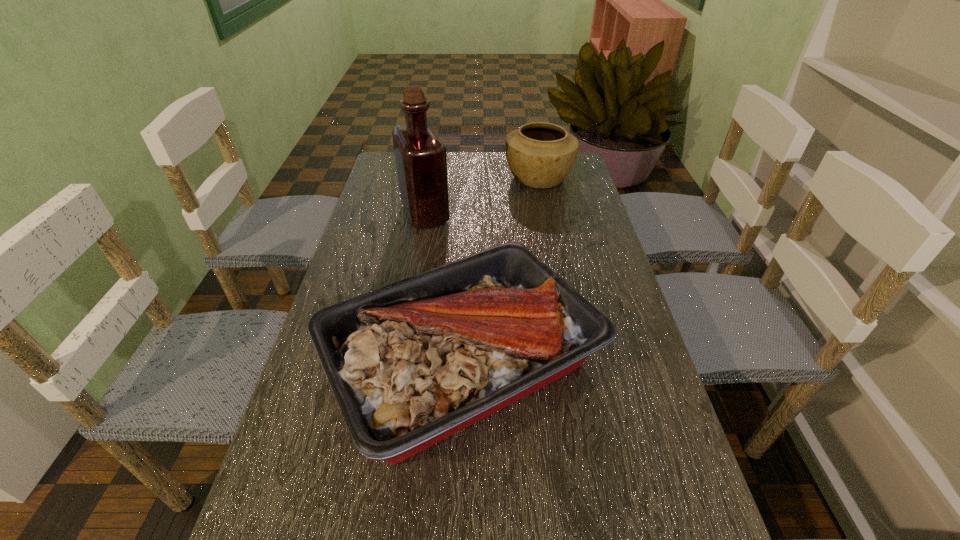
Find the location of a particular element. The width and height of the screenshot is (960, 540). tray that is at the left edge is located at coordinates (411, 363).

Identify the location of pottery located in the right edge section of the desktop. The height and width of the screenshot is (540, 960). (540, 155).

This screenshot has width=960, height=540. I want to click on tray that is at the right edge, so click(411, 363).

The width and height of the screenshot is (960, 540). I want to click on object present at the far right corner, so click(540, 155).

This screenshot has width=960, height=540. Identify the location of vacant space at the far edge. (452, 181).

Locate an element on the screen. The image size is (960, 540). vacant space at the left edge of the desktop is located at coordinates (372, 218).

In order to click on free space at the right edge in this screenshot , I will do `click(587, 222)`.

Where is `free point between the farthest object and the liquor`? The width and height of the screenshot is (960, 540). free point between the farthest object and the liquor is located at coordinates coord(482,195).

Select which object appears as the second closest to the tallest object. Please provide its 2D coordinates. Your answer should be formatted as a tuple, i.e. [(x, y)], where the tuple contains the x and y coordinates of a point satisfying the conditions above.

[(411, 363)]

Point out which object is positioned as the second nearest to the second nearest object. Please provide its 2D coordinates. Your answer should be formatted as a tuple, i.e. [(x, y)], where the tuple contains the x and y coordinates of a point satisfying the conditions above.

[(411, 363)]